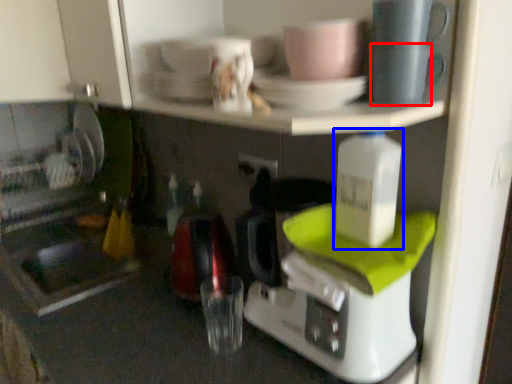
Question: Among these objects, which one is farthest to the camera, tableware (highlighted by a red box) or bottle (highlighted by a blue box)?

Choices:
 (A) tableware
 (B) bottle

Answer: (B)